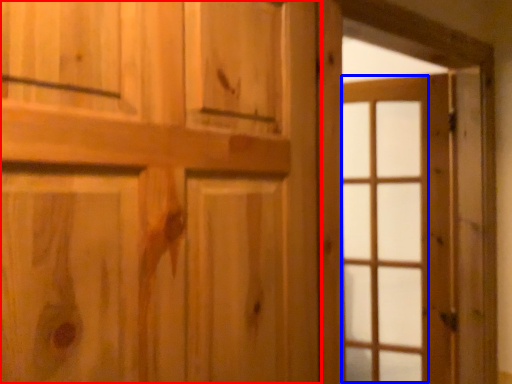
Question: Which of the following is the closest to the observer, door (highlighted by a red box) or glass door (highlighted by a blue box)?

Choices:
 (A) door
 (B) glass door

Answer: (A)